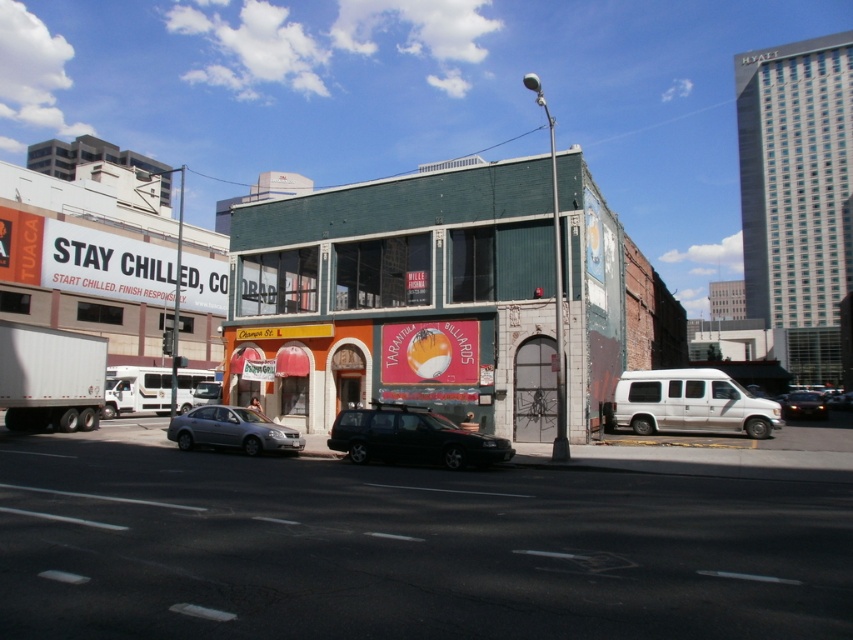
Does green brick building at center have a larger size compared to silver metallic sedan at center?

Correct, green brick building at center is larger in size than silver metallic sedan at center.

Can you confirm if green brick building at center is thinner than silver metallic sedan at center?

No, green brick building at center is not thinner than silver metallic sedan at center.

Who is more forward, (312, 401) or (180, 435)?

Point (180, 435) is in front.

The image size is (853, 640). Find the location of `green brick building at center`. green brick building at center is located at coordinates (399, 298).

Who is positioned more to the right, silver metallic van at right or silver metallic sedan at center?

From the viewer's perspective, silver metallic van at right appears more on the right side.

Does silver metallic van at right have a greater height compared to silver metallic sedan at center?

Yes, silver metallic van at right is taller than silver metallic sedan at center.

Identify the location of silver metallic van at right. This screenshot has width=853, height=640. (689, 403).

Find the location of `silver metallic van at right`. silver metallic van at right is located at coordinates (689, 403).

This screenshot has height=640, width=853. I want to click on silver metallic van at right, so click(x=689, y=403).

Can you confirm if silver metallic van at right is taller than shiny black suv at center?

Yes, silver metallic van at right is taller than shiny black suv at center.

Between point (621, 397) and point (339, 429), which one is positioned behind?

The point (621, 397) is behind.

In order to click on silver metallic van at right in this screenshot , I will do `click(689, 403)`.